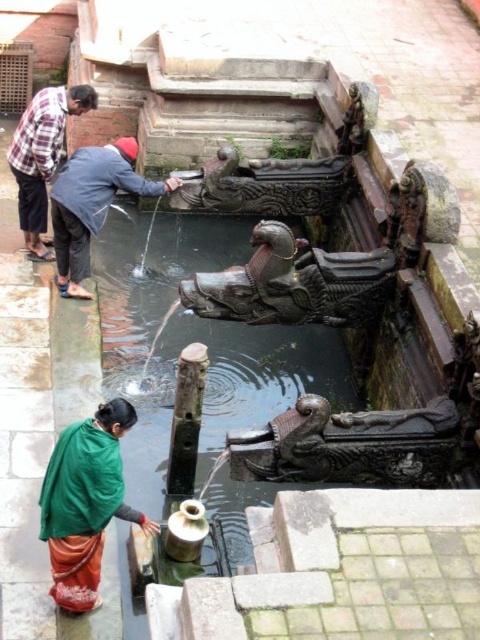
Question: Which is nearer to the plaid shirt at upper left?

Choices:
 (A) black polished stone dragon at center
 (B) dark brown stone dragon at center

Answer: (A)

Question: Does green fabric at lower left appear over plaid shirt at upper left?

Choices:
 (A) no
 (B) yes

Answer: (A)

Question: Which of the following is the closest to the observer?

Choices:
 (A) green fabric at lower left
 (B) plaid shirt at upper left
 (C) black polished stone dragon at center

Answer: (A)

Question: Does green fabric at lower left have a lesser width compared to blue fabric shirt at upper left?

Choices:
 (A) yes
 (B) no

Answer: (A)

Question: Can you confirm if dark brown stone dragon at center is positioned below blue fabric shirt at upper left?

Choices:
 (A) no
 (B) yes

Answer: (B)

Question: Estimate the real-world distances between objects in this image. Which object is farther from the plaid shirt at upper left?

Choices:
 (A) green fabric at lower left
 (B) black polished stone dragon at center

Answer: (A)